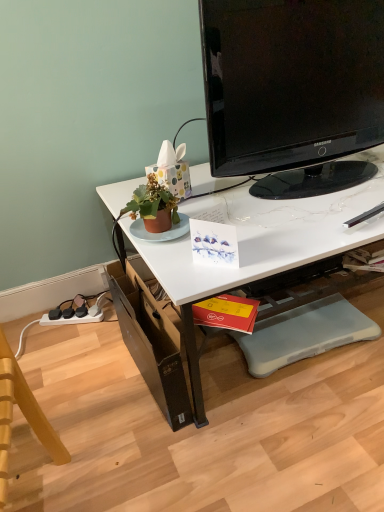
Question: Is black glossy television at upper center aimed at red matte book at lower center?

Choices:
 (A) no
 (B) yes

Answer: (A)

Question: Is black glossy television at upper center directly adjacent to red matte book at lower center?

Choices:
 (A) yes
 (B) no

Answer: (B)

Question: From a real-world perspective, is black glossy television at upper center positioned over red matte book at lower center based on gravity?

Choices:
 (A) yes
 (B) no

Answer: (A)

Question: Can you confirm if black glossy television at upper center is positioned to the right of red matte book at lower center?

Choices:
 (A) no
 (B) yes

Answer: (B)

Question: Does black glossy television at upper center have a lesser width compared to red matte book at lower center?

Choices:
 (A) yes
 (B) no

Answer: (B)

Question: Considering the relative sizes of black glossy television at upper center and red matte book at lower center in the image provided, is black glossy television at upper center bigger than red matte book at lower center?

Choices:
 (A) yes
 (B) no

Answer: (A)

Question: Does gray rubber footrest at lower center have a larger size compared to black glossy television at upper center?

Choices:
 (A) no
 (B) yes

Answer: (A)

Question: Is the depth of gray rubber footrest at lower center greater than that of black glossy television at upper center?

Choices:
 (A) yes
 (B) no

Answer: (A)

Question: Is there a large distance between gray rubber footrest at lower center and black glossy television at upper center?

Choices:
 (A) no
 (B) yes

Answer: (A)

Question: Would you say black glossy television at upper center is part of gray rubber footrest at lower center's contents?

Choices:
 (A) no
 (B) yes

Answer: (A)

Question: Does gray rubber footrest at lower center have a smaller size compared to black glossy television at upper center?

Choices:
 (A) yes
 (B) no

Answer: (A)

Question: Can you confirm if gray rubber footrest at lower center is taller than black glossy television at upper center?

Choices:
 (A) no
 (B) yes

Answer: (A)

Question: From a real-world perspective, does gray rubber footrest at lower center sit lower than white glossy desk at upper center?

Choices:
 (A) yes
 (B) no

Answer: (A)